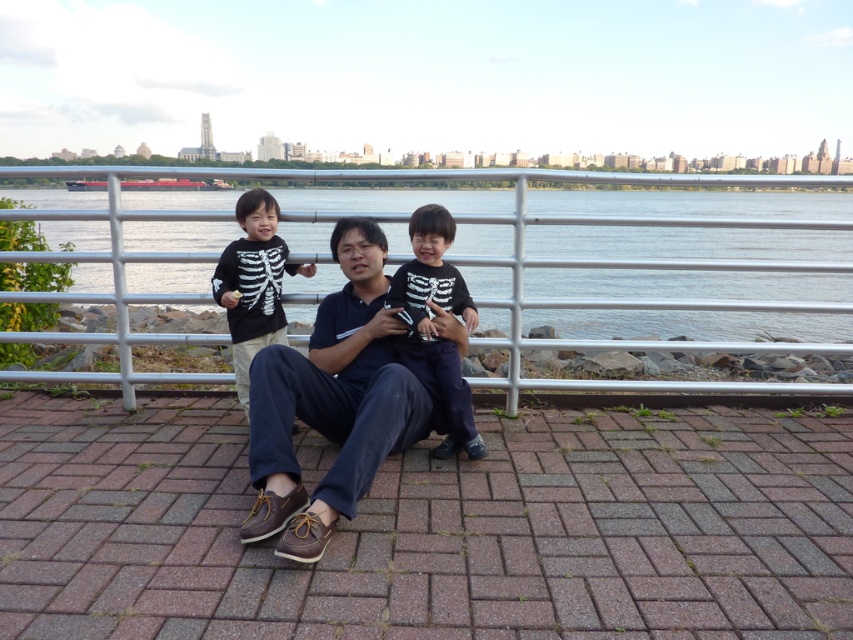
You are a photographer trying to capture the blue water at center and the black matte skeleton shirt at left in the same frame. Based on their sizes in the image, which one would you need to focus on more closely to ensure it appears detailed in the photo?

The blue water at center is larger in size than the black matte skeleton shirt at left, so you would need to focus more closely on the black matte skeleton shirt at left to ensure its details are captured clearly in the photo.

You are standing on the brick paved area and want to walk to the blue water at center. Which direction should you move relative to the brown leather shoes at center?

To reach the blue water at center, you should move to the left side of the brown leather shoes at center since the blue water at center is positioned on the left side of them.

In the scene shown: You are a photographer taking a picture of the two points in the scene. Which point, point (289,506) or point (271,218), will appear larger in your photo?

Point (289,506) will appear larger in the photo because it is closer to the camera than point (271,218).